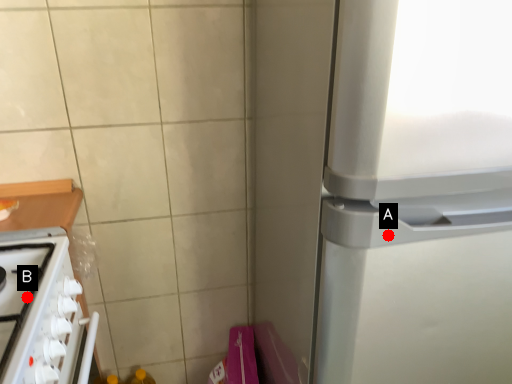
Question: Two points are circled on the image, labeled by A and B beside each circle. Which point is further to the camera?

Choices:
 (A) A is further
 (B) B is further

Answer: (B)